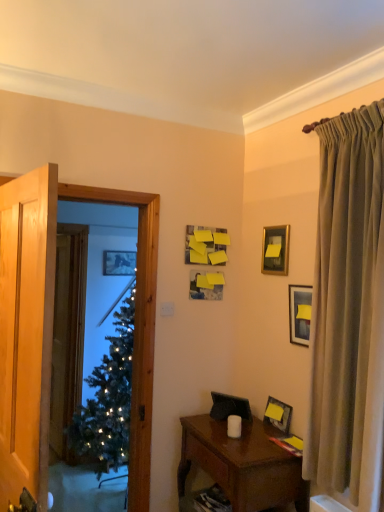
Question: Is metallic silver picture frame at upper left, marked as the 5th picture frame in a front-to-back arrangement, not inside yellow matte picture frame at upper right, positioned as the 4th picture frame in top-to-bottom order?

Choices:
 (A) no
 (B) yes

Answer: (B)

Question: Does metallic silver picture frame at upper left, marked as the 5th picture frame in a front-to-back arrangement, have a lesser width compared to yellow matte picture frame at upper right, arranged as the 5th picture frame when viewed from the back?

Choices:
 (A) no
 (B) yes

Answer: (B)

Question: Are metallic silver picture frame at upper left, placed as the first picture frame when sorted from back to front, and yellow matte picture frame at upper right, the fifth picture frame positioned from the left, far apart?

Choices:
 (A) no
 (B) yes

Answer: (B)

Question: Is metallic silver picture frame at upper left, which is the 2th picture frame in top-to-bottom order, surrounding yellow matte picture frame at upper right, which is the 2th picture frame from bottom to top?

Choices:
 (A) no
 (B) yes

Answer: (A)

Question: Considering the relative sizes of metallic silver picture frame at upper left, which is the 2th picture frame in top-to-bottom order, and yellow matte picture frame at upper right, arranged as the first picture frame when viewed from the front, in the image provided, is metallic silver picture frame at upper left, which is the 2th picture frame in top-to-bottom order, bigger than yellow matte picture frame at upper right, arranged as the first picture frame when viewed from the front,?

Choices:
 (A) no
 (B) yes

Answer: (A)

Question: Considering their positions, is green frosted glass window screen at left located in front of or behind metallic silver picture frame at upper left, which is the 2th picture frame in top-to-bottom order?

Choices:
 (A) behind
 (B) front

Answer: (B)

Question: From the image's perspective, is green frosted glass window screen at left above or below metallic silver picture frame at upper left, marked as the 5th picture frame in a front-to-back arrangement?

Choices:
 (A) above
 (B) below

Answer: (B)

Question: From a real-world perspective, is green frosted glass window screen at left above or below metallic silver picture frame at upper left, the fifth picture frame in the right-to-left sequence?

Choices:
 (A) below
 (B) above

Answer: (A)

Question: Is point (152, 316) closer or farther from the camera than point (119, 266)?

Choices:
 (A) closer
 (B) farther

Answer: (A)

Question: Considering the positions of silky beige curtain at right and white matte candle at center in the image, is silky beige curtain at right bigger or smaller than white matte candle at center?

Choices:
 (A) small
 (B) big

Answer: (B)

Question: From their relative heights in the image, would you say silky beige curtain at right is taller or shorter than white matte candle at center?

Choices:
 (A) tall
 (B) short

Answer: (A)

Question: Is silky beige curtain at right situated inside white matte candle at center or outside?

Choices:
 (A) outside
 (B) inside

Answer: (A)

Question: From a real-world perspective, is silky beige curtain at right positioned above or below white matte candle at center?

Choices:
 (A) below
 (B) above

Answer: (B)

Question: From a real-world perspective, is brown wooden nightstand at lower right physically located above or below gold metallic picture frame at upper right, the 5th picture frame when ordered from bottom to top?

Choices:
 (A) above
 (B) below

Answer: (B)

Question: From the image's perspective, is brown wooden nightstand at lower right above or below gold metallic picture frame at upper right, positioned as the 2th picture frame in right-to-left order?

Choices:
 (A) below
 (B) above

Answer: (A)